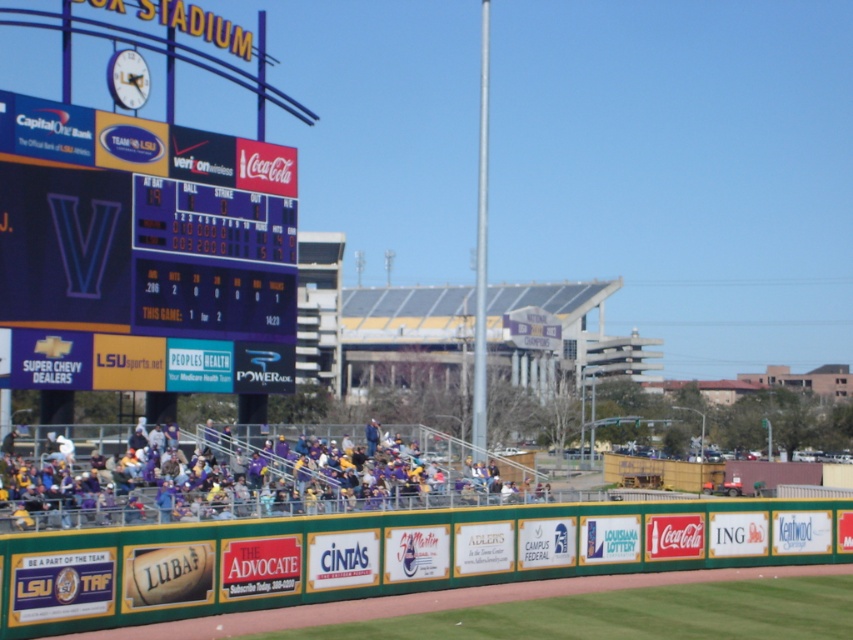
Question: Is purple glossy scoreboard at left to the right of purple jersey at center from the viewer's perspective?

Choices:
 (A) no
 (B) yes

Answer: (A)

Question: Among these points, which one is nearest to the camera?

Choices:
 (A) (471, 492)
 (B) (173, 364)

Answer: (B)

Question: Observing the image, what is the correct spatial positioning of purple glossy scoreboard at left in reference to purple jersey at center?

Choices:
 (A) below
 (B) above

Answer: (B)

Question: Can you confirm if purple glossy scoreboard at left is bigger than purple jersey at center?

Choices:
 (A) yes
 (B) no

Answer: (B)

Question: Among these points, which one is farthest from the camera?

Choices:
 (A) (289, 216)
 (B) (457, 449)

Answer: (B)